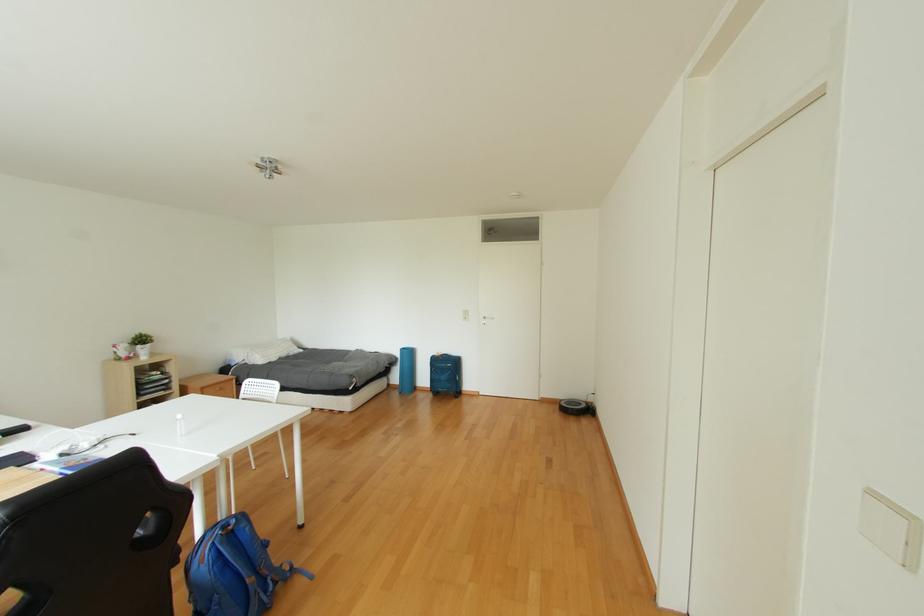
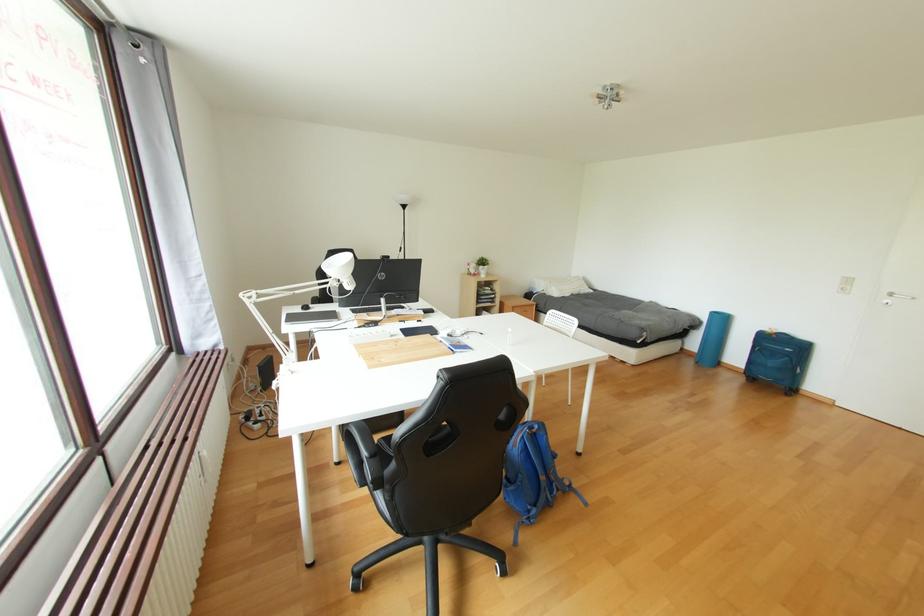
Question: How did the camera likely rotate?

Choices:
 (A) Left
 (B) Right
 (C) Up
 (D) Down

Answer: (A)